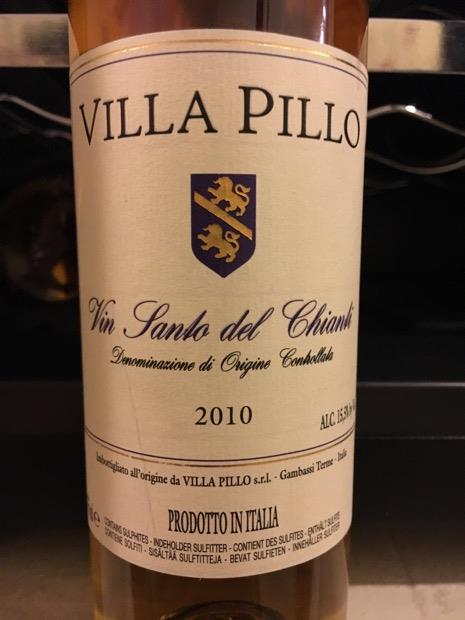
I want to click on handle, so click(x=391, y=50).